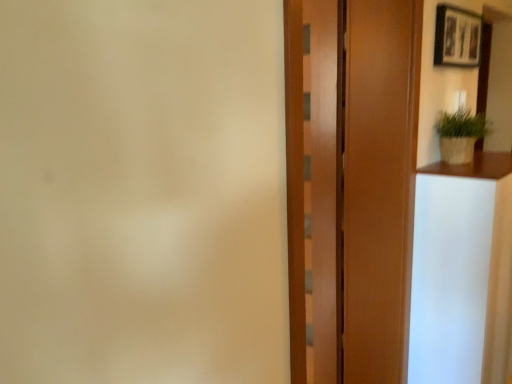
Question: Would you say wooden door at center contains green woven basket at upper right?

Choices:
 (A) yes
 (B) no

Answer: (B)

Question: Can you confirm if wooden door at center is bigger than green woven basket at upper right?

Choices:
 (A) yes
 (B) no

Answer: (A)

Question: Is wooden door at center touching green woven basket at upper right?

Choices:
 (A) no
 (B) yes

Answer: (A)

Question: From a real-world perspective, does wooden door at center stand above green woven basket at upper right?

Choices:
 (A) yes
 (B) no

Answer: (B)

Question: Does wooden door at center come behind green woven basket at upper right?

Choices:
 (A) yes
 (B) no

Answer: (B)

Question: Considering the relative sizes of wooden door at center and green woven basket at upper right in the image provided, is wooden door at center taller than green woven basket at upper right?

Choices:
 (A) yes
 (B) no

Answer: (A)

Question: Is wooden barn door at center beside green woven basket at upper right?

Choices:
 (A) yes
 (B) no

Answer: (B)

Question: From a real-world perspective, is wooden barn door at center on green woven basket at upper right?

Choices:
 (A) yes
 (B) no

Answer: (B)

Question: Can you confirm if wooden barn door at center is positioned to the right of green woven basket at upper right?

Choices:
 (A) yes
 (B) no

Answer: (B)

Question: Is wooden barn door at center not near green woven basket at upper right?

Choices:
 (A) no
 (B) yes

Answer: (A)

Question: From a real-world perspective, does wooden barn door at center sit lower than green woven basket at upper right?

Choices:
 (A) no
 (B) yes

Answer: (B)

Question: Can you confirm if wooden barn door at center is shorter than green woven basket at upper right?

Choices:
 (A) no
 (B) yes

Answer: (A)

Question: Is wooden door at center at the left side of wooden picture frame at upper right?

Choices:
 (A) yes
 (B) no

Answer: (A)